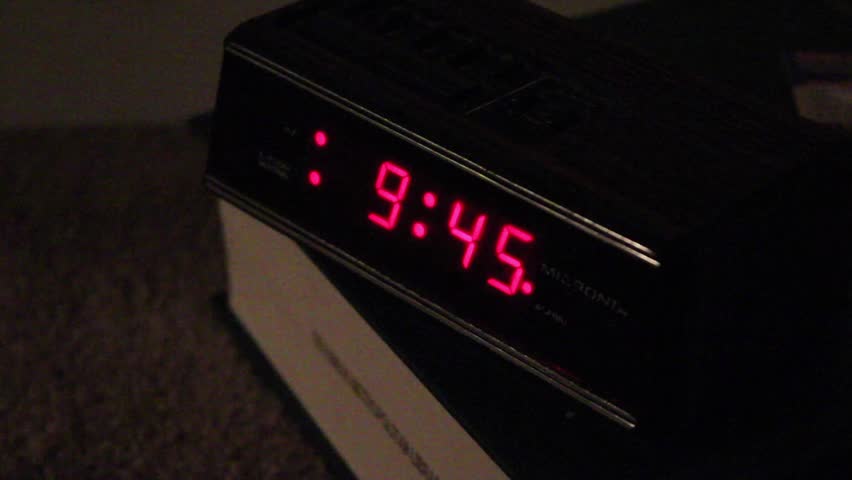
Image resolution: width=852 pixels, height=480 pixels. What are the coordinates of `table` in the screenshot? It's located at (233, 382).